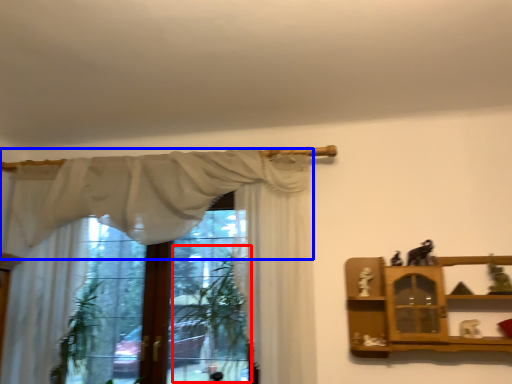
Question: Which object is closer to the camera taking this photo, plant (highlighted by a red box) or curtain (highlighted by a blue box)?

Choices:
 (A) plant
 (B) curtain

Answer: (B)